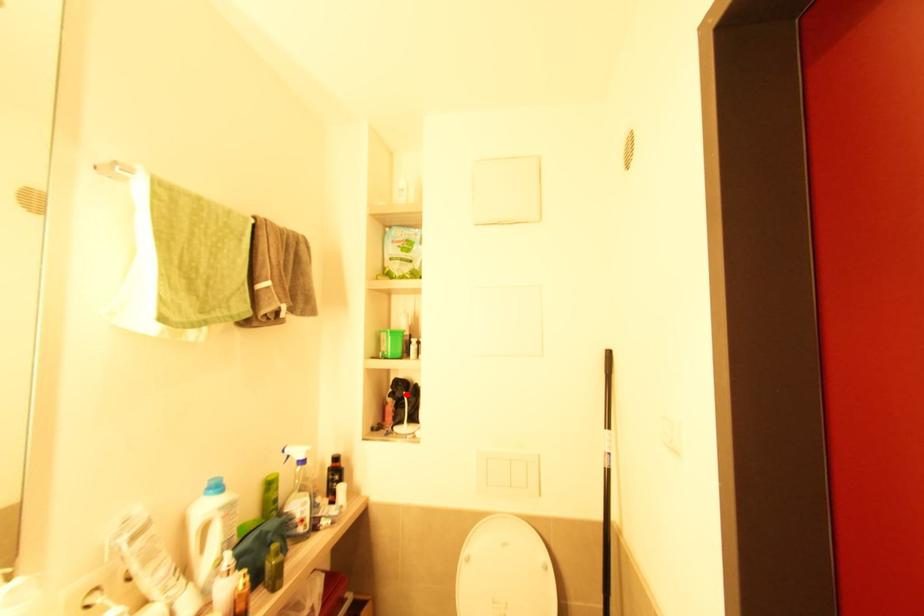
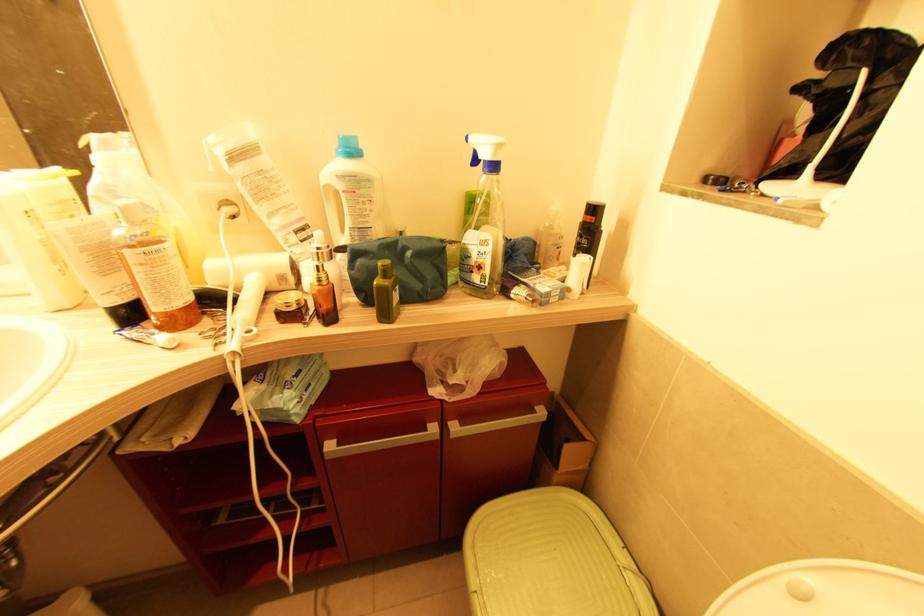
Where in the second image is the point corresponding to the highlighted location from the first image?

(867, 73)